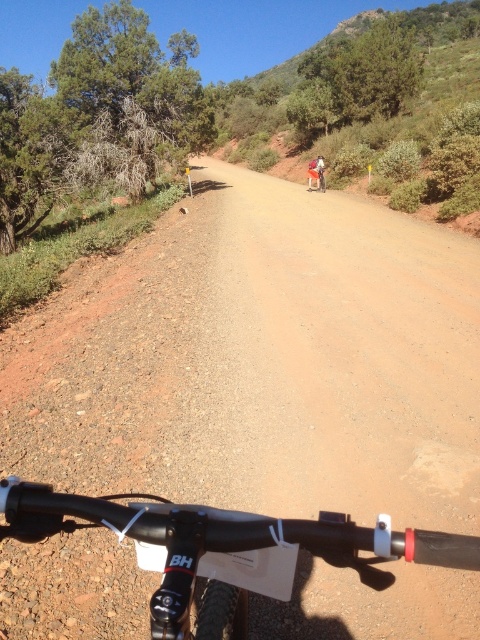
Between point (117, 529) and point (315, 179), which one is positioned behind?

The point (315, 179) is more distant.

Which is in front, point (289, 570) or point (322, 157)?

Point (289, 570)

At what (x,y) coordinates should I click in order to perform the action: click on black matte bicycle handlebar at bottom. Please return your answer as a coordinate pair (x, y). Image resolution: width=480 pixels, height=640 pixels. Looking at the image, I should click on (228, 550).